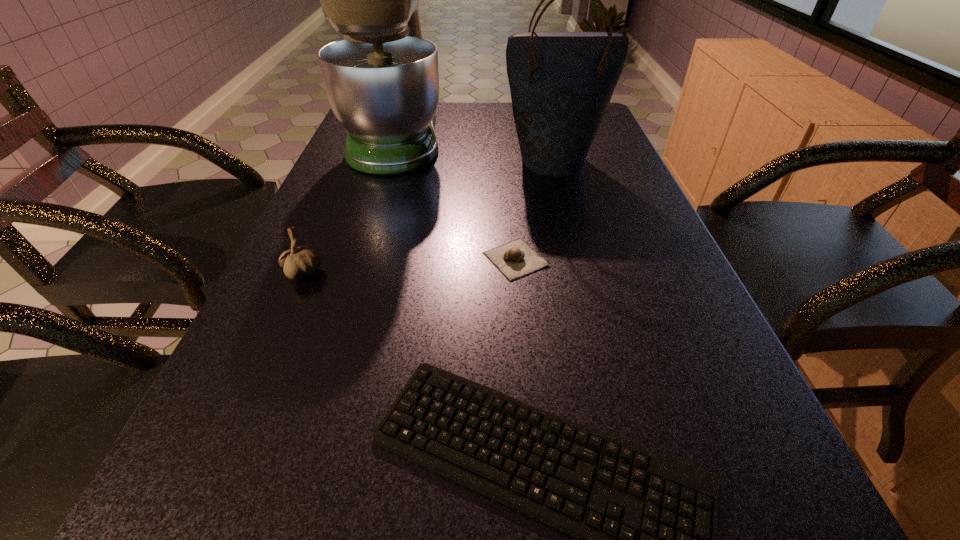
Where is `object located at the far edge`? object located at the far edge is located at coordinates (382, 81).

Locate an element on the screen. mixer positioned at the left edge is located at coordinates (382, 81).

Locate an element on the screen. garlic located at the left edge is located at coordinates (298, 262).

The width and height of the screenshot is (960, 540). I want to click on object that is positioned at the right edge, so click(561, 83).

This screenshot has height=540, width=960. I want to click on object located in the far left corner section of the desktop, so click(x=382, y=81).

In order to click on free space at the far edge in this screenshot , I will do `click(468, 106)`.

Where is `vacant space at the left edge of the desktop`? Image resolution: width=960 pixels, height=540 pixels. vacant space at the left edge of the desktop is located at coordinates (334, 179).

What are the coordinates of `free space at the right edge` in the screenshot? It's located at (658, 232).

Image resolution: width=960 pixels, height=540 pixels. I want to click on vacant area at the near left corner of the desktop, so click(251, 537).

Locate an element on the screen. empty space that is in between the right garlic and the mixer is located at coordinates (456, 199).